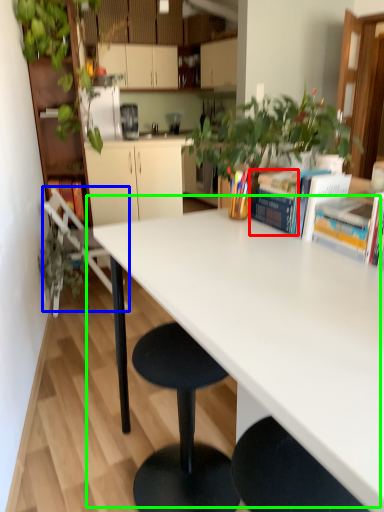
Question: Which is farther away from book (highlighted by a red box)? chair (highlighted by a blue box) or table (highlighted by a green box)?

Choices:
 (A) chair
 (B) table

Answer: (A)